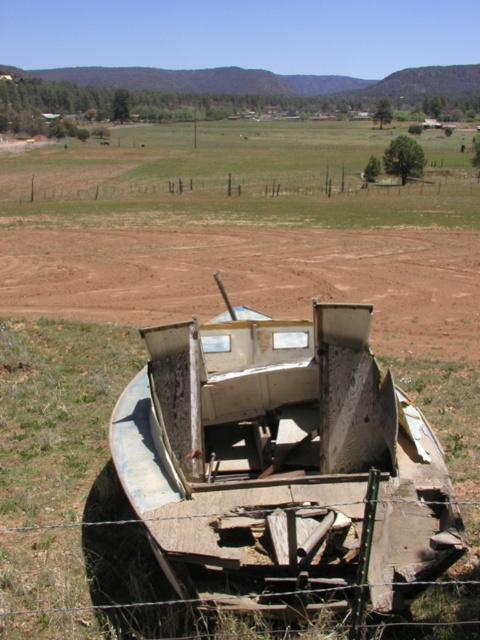
Question: Can you confirm if rusty metal boat at center is thinner than brown dirt field at center?

Choices:
 (A) no
 (B) yes

Answer: (B)

Question: Which point appears closest to the camera in this image?

Choices:
 (A) (144, 180)
 (B) (454, 275)
 (C) (299, 449)

Answer: (C)

Question: Is rusty metal boat at center to the left of brown dirt field at center from the viewer's perspective?

Choices:
 (A) no
 (B) yes

Answer: (B)

Question: Can you confirm if rusty metal boat at center is positioned above brown dirt field at center?

Choices:
 (A) no
 (B) yes

Answer: (A)

Question: Which point is closer to the camera taking this photo?

Choices:
 (A) (415, 556)
 (B) (34, 182)
 (C) (12, 241)

Answer: (A)

Question: Which of these objects is positioned farthest from the brown wooden fence at upper center?

Choices:
 (A) brown dirt field at center
 (B) rusty metal boat at center

Answer: (B)